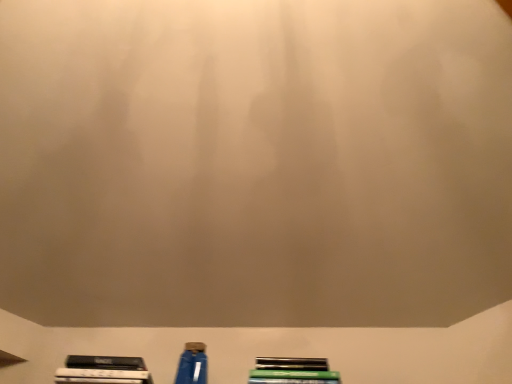
Question: Is metallic green book at lower center thinner than blue plastic bottle at lower center?

Choices:
 (A) no
 (B) yes

Answer: (A)

Question: Does metallic green book at lower center lie behind blue plastic bottle at lower center?

Choices:
 (A) yes
 (B) no

Answer: (B)

Question: Can you confirm if metallic green book at lower center is shorter than blue plastic bottle at lower center?

Choices:
 (A) no
 (B) yes

Answer: (B)

Question: Is metallic green book at lower center not inside blue plastic bottle at lower center?

Choices:
 (A) no
 (B) yes

Answer: (B)

Question: From the image's perspective, is metallic green book at lower center above blue plastic bottle at lower center?

Choices:
 (A) no
 (B) yes

Answer: (A)

Question: Is metallic green book at lower center placed right next to blue plastic bottle at lower center?

Choices:
 (A) yes
 (B) no

Answer: (B)

Question: Considering the relative sizes of blue plastic bottle at lower center and metallic green book at lower center in the image provided, is blue plastic bottle at lower center bigger than metallic green book at lower center?

Choices:
 (A) no
 (B) yes

Answer: (A)

Question: Is the position of blue plastic bottle at lower center less distant than that of metallic green book at lower center?

Choices:
 (A) yes
 (B) no

Answer: (B)

Question: Is blue plastic bottle at lower center taller than metallic green book at lower center?

Choices:
 (A) yes
 (B) no

Answer: (A)

Question: Can you confirm if blue plastic bottle at lower center is thinner than metallic green book at lower center?

Choices:
 (A) no
 (B) yes

Answer: (B)

Question: Considering the relative sizes of blue plastic bottle at lower center and metallic green book at lower center in the image provided, is blue plastic bottle at lower center wider than metallic green book at lower center?

Choices:
 (A) yes
 (B) no

Answer: (B)

Question: From a real-world perspective, is blue plastic bottle at lower center physically below metallic green book at lower center?

Choices:
 (A) yes
 (B) no

Answer: (B)

Question: Looking at the image, does metallic green book at lower center seem bigger or smaller compared to blue plastic bottle at lower center?

Choices:
 (A) small
 (B) big

Answer: (B)